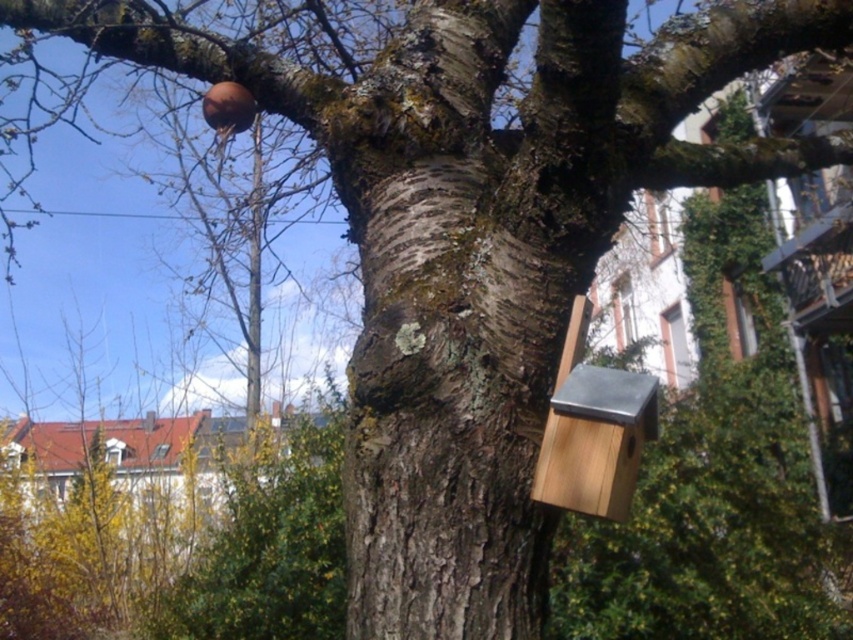
Who is higher up, smooth bark tree trunk at center or wooden birdhouse at right?

smooth bark tree trunk at center

Does smooth bark tree trunk at center appear on the right side of wooden birdhouse at right?

Incorrect, smooth bark tree trunk at center is not on the right side of wooden birdhouse at right.

What do you see at coordinates (451, 384) in the screenshot? I see `smooth bark tree trunk at center` at bounding box center [451, 384].

The image size is (853, 640). I want to click on smooth bark tree trunk at center, so click(x=451, y=384).